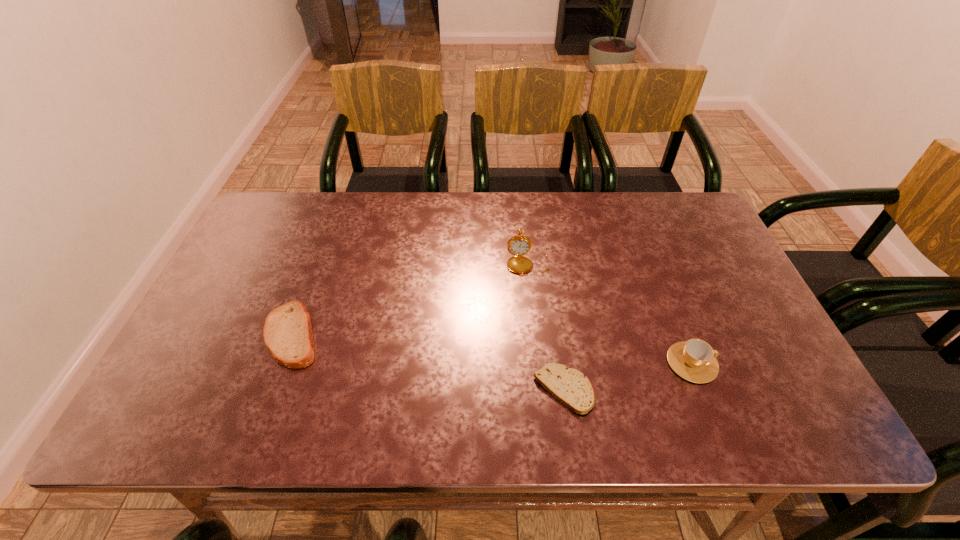
Where is `pocket watch`? Image resolution: width=960 pixels, height=540 pixels. pocket watch is located at coordinates (519, 245).

Find the location of a particular element. The image size is (960, 540). the farthest object is located at coordinates (519, 245).

Identify the location of the third shortest object. The image size is (960, 540). (694, 360).

Locate an element on the screen. Image resolution: width=960 pixels, height=540 pixels. cup is located at coordinates (694, 360).

This screenshot has height=540, width=960. What are the coordinates of `the leftmost object` in the screenshot? It's located at (287, 332).

The width and height of the screenshot is (960, 540). In order to click on the left pita bread in this screenshot , I will do `click(287, 332)`.

At what (x,y) coordinates should I click in order to perform the action: click on the shortest object. Please return your answer as a coordinate pair (x, y). The height and width of the screenshot is (540, 960). Looking at the image, I should click on (570, 386).

Find the location of a particular element. This screenshot has height=540, width=960. the right pita bread is located at coordinates (570, 386).

Locate an element on the screen. free space located 0.100m on the face of the farthest object is located at coordinates coord(531,302).

Find the location of a particular element. vacant space located 0.160m with the handle on the side of the rightmost object is located at coordinates (785, 362).